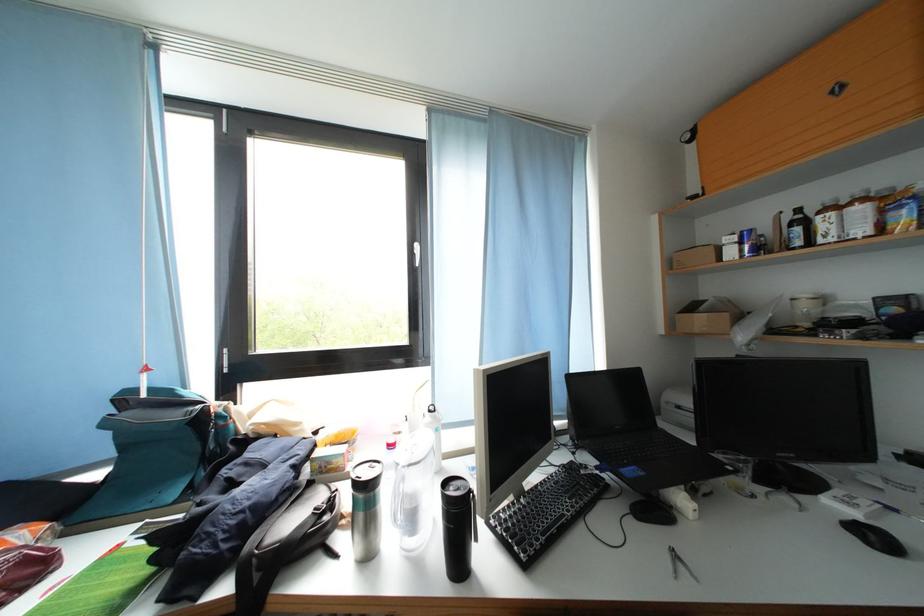
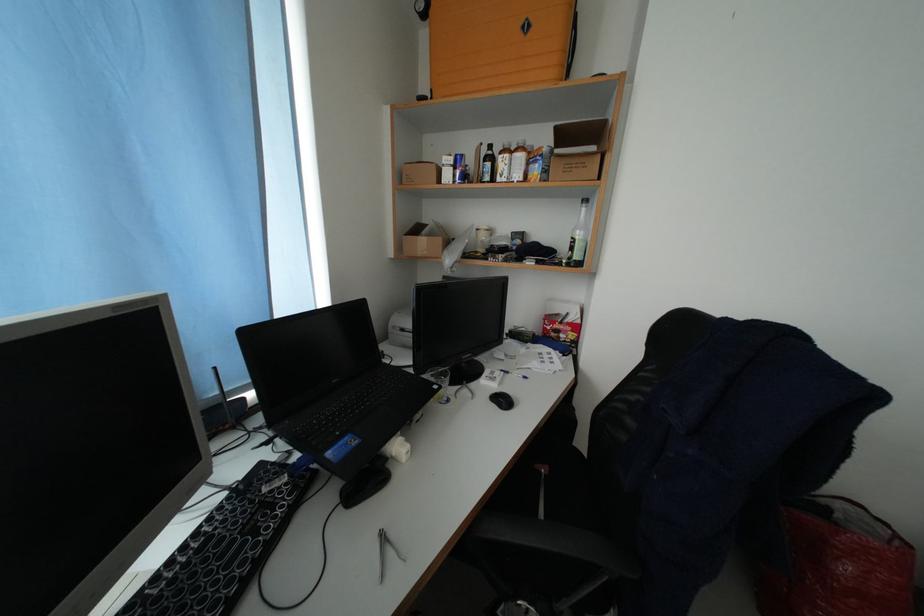
The point at (883, 544) is marked in the first image. Where is the corresponding point in the second image?

(512, 406)